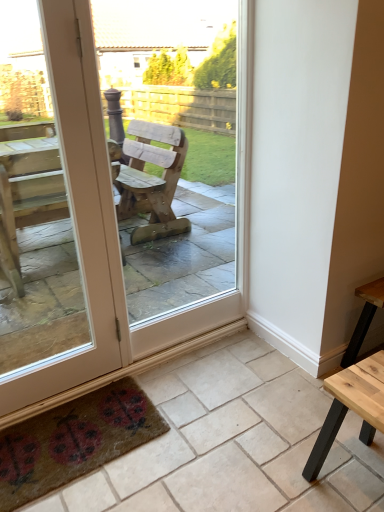
I want to click on vacant area located to the right-hand side of textured brown mat with ladybugs at lower left, so click(x=200, y=428).